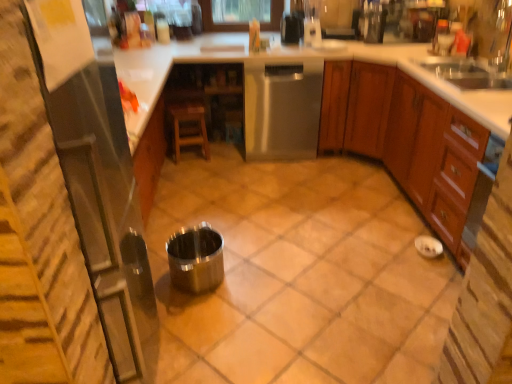
Question: Is clear glass blender at upper center, marked as the 5th appliance in a front-to-back arrangement, positioned with its back to stainless steel dishwasher at center?

Choices:
 (A) no
 (B) yes

Answer: (A)

Question: From the image's perspective, is clear glass blender at upper center, arranged as the fifth appliance when ordered from the bottom, over stainless steel dishwasher at center?

Choices:
 (A) no
 (B) yes

Answer: (B)

Question: Does clear glass blender at upper center, positioned as the 1th appliance in back-to-front order, have a larger size compared to stainless steel dishwasher at center?

Choices:
 (A) yes
 (B) no

Answer: (B)

Question: Is clear glass blender at upper center, which is the 1th appliance from top to bottom, surrounding stainless steel dishwasher at center?

Choices:
 (A) no
 (B) yes

Answer: (A)

Question: From the image's perspective, would you say clear glass blender at upper center, marked as the 5th appliance in a front-to-back arrangement, is shown under stainless steel dishwasher at center?

Choices:
 (A) no
 (B) yes

Answer: (A)

Question: From a real-world perspective, relative to metallic silver at center, is brown wood cabinet at right vertically above or below?

Choices:
 (A) below
 (B) above

Answer: (B)

Question: Based on their positions, is brown wood cabinet at right located to the left or right of metallic silver at center?

Choices:
 (A) right
 (B) left

Answer: (A)

Question: Considering the positions of brown wood cabinet at right and metallic silver at center in the image, is brown wood cabinet at right wider or thinner than metallic silver at center?

Choices:
 (A) thin
 (B) wide

Answer: (A)

Question: In terms of size, does brown wood cabinet at right appear bigger or smaller than metallic silver at center?

Choices:
 (A) small
 (B) big

Answer: (B)

Question: Considering their positions, is stainless steel dishwasher at center located in front of or behind metallic stainless steel coffee maker at upper right, marked as the 5th appliance in a left-to-right arrangement?

Choices:
 (A) front
 (B) behind

Answer: (A)

Question: Is stainless steel dishwasher at center taller or shorter than metallic stainless steel coffee maker at upper right, arranged as the fourth appliance when viewed from the front?

Choices:
 (A) short
 (B) tall

Answer: (B)

Question: Looking at the image, does stainless steel dishwasher at center seem bigger or smaller compared to metallic stainless steel coffee maker at upper right, the 2th appliance viewed from the back?

Choices:
 (A) big
 (B) small

Answer: (A)

Question: Looking at their shapes, would you say stainless steel dishwasher at center is wider or thinner than metallic stainless steel coffee maker at upper right, the 2th appliance viewed from the back?

Choices:
 (A) thin
 (B) wide

Answer: (B)

Question: Looking at the image, does stainless steel dishwasher at center seem bigger or smaller compared to clear glass blender at upper center, which is the 1th appliance from top to bottom?

Choices:
 (A) small
 (B) big

Answer: (B)

Question: Considering the positions of point pos(286,155) and point pos(311,43), is point pos(286,155) closer or farther from the camera than point pos(311,43)?

Choices:
 (A) farther
 (B) closer

Answer: (A)